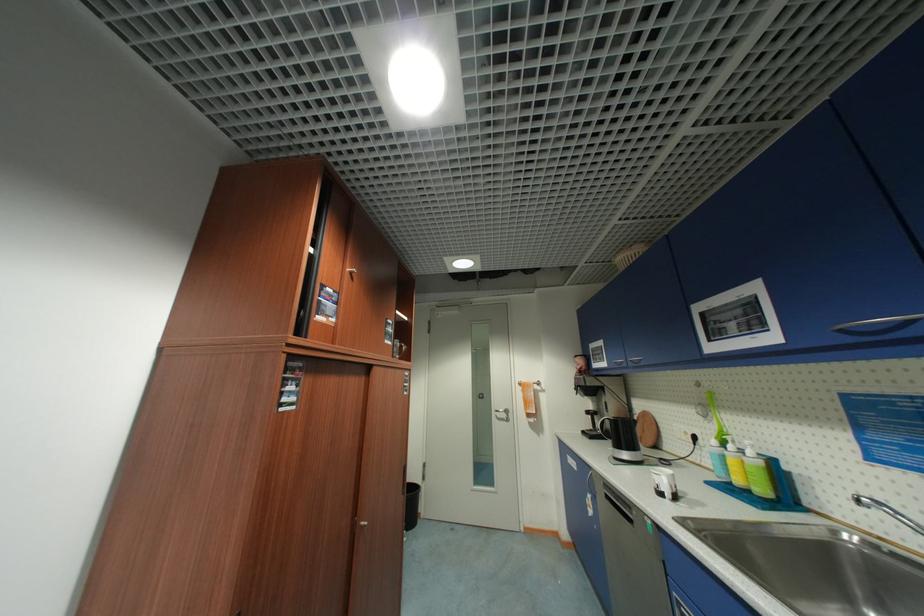
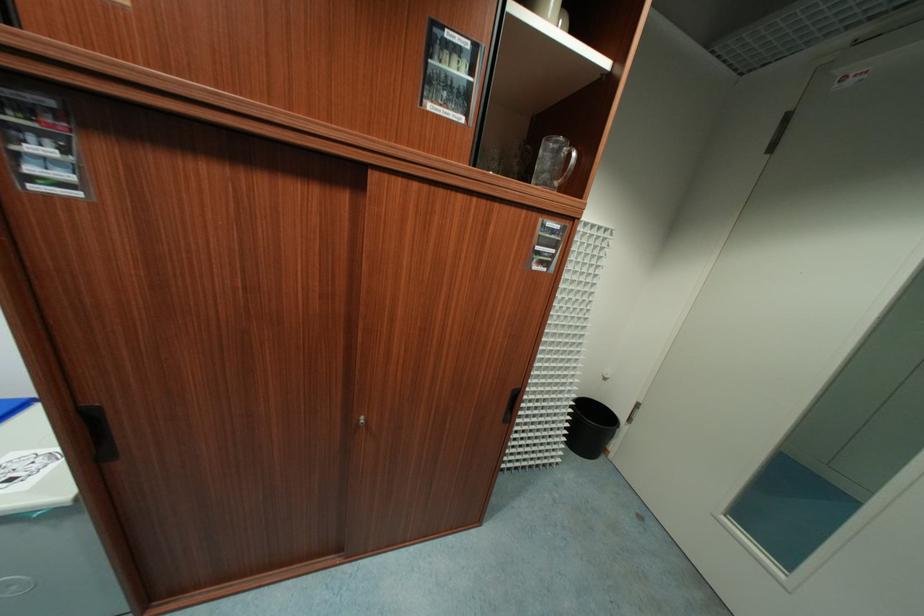
Locate, in the second image, the point that corresponds to point (407, 347) in the first image.

(574, 158)